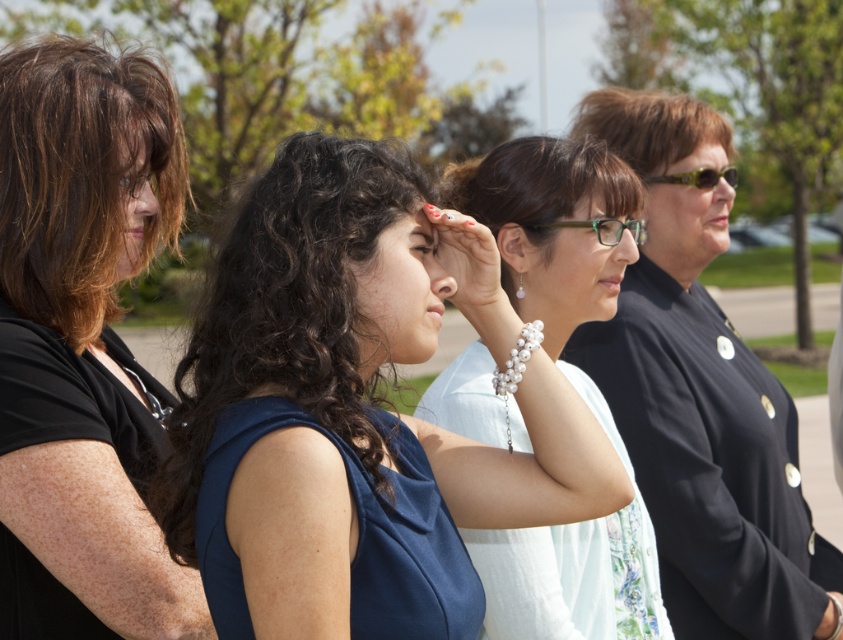
Which is behind, point (355, 492) or point (0, 531)?

The point (0, 531) is more distant.

Is navy blue fabric dress at center further to the viewer compared to dark blue fabric dress at left?

No, navy blue fabric dress at center is in front of dark blue fabric dress at left.

Which is in front, point (455, 545) or point (63, 371)?

Point (455, 545)

You are a GUI agent. You are given a task and a screenshot of the screen. Output one action in this format:
    pyautogui.click(x=<x>, y=<y>)
    Task: Click on the navy blue fabric dress at center
    
    Given the screenshot: What is the action you would take?
    pyautogui.click(x=358, y=532)

Which of these two, matte black hair at upper right or green plastic glasses at center, stands shorter?

green plastic glasses at center is shorter.

Does point (707, 451) come farther from viewer compared to point (561, 224)?

Yes.

I want to click on matte black hair at upper right, so click(707, 438).

Does white pearl bracelet at center have a greater width compared to yellow-green plastic sunglasses at right?

Yes, white pearl bracelet at center is wider than yellow-green plastic sunglasses at right.

What are the coordinates of `white pearl bracelet at center` in the screenshot? It's located at (551, 227).

Locate an element on the screen. white pearl bracelet at center is located at coordinates tap(551, 227).

Image resolution: width=843 pixels, height=640 pixels. What are the coordinates of `white pearl bracelet at center` in the screenshot? It's located at (551, 227).